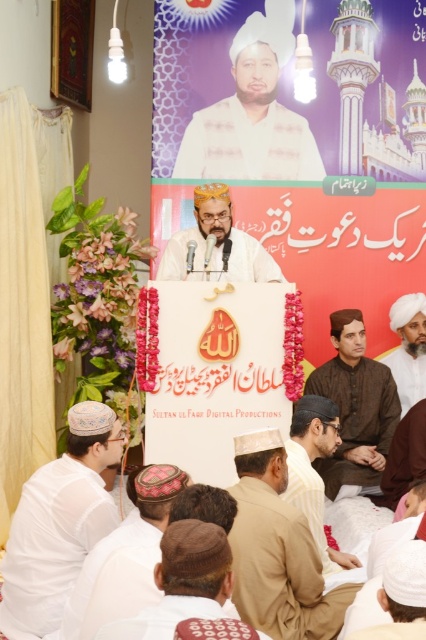
Question: Is white cotton cap at lower left wider than brown textured hat at lower center?

Choices:
 (A) yes
 (B) no

Answer: (A)

Question: Does matte gold crown at center appear over white matte turban at center?

Choices:
 (A) no
 (B) yes

Answer: (B)

Question: Which of the following is the farthest from the observer?

Choices:
 (A) light brown fabric at lower center
 (B) matte gold crown at center
 (C) brown cotton shirt at center
 (D) light brown fabric cap at center

Answer: (C)

Question: Which point appears closest to the camera in this image?

Choices:
 (A) (342, 557)
 (B) (339, 486)
 (C) (78, 497)
 (D) (213, 275)

Answer: (C)

Question: Based on their relative distances, which object is farther from the matte gold crown at center?

Choices:
 (A) white matte shirt at upper center
 (B) light brown fabric cap at center
 (C) white cotton turban at lower center
 (D) brown cotton shirt at center

Answer: (C)

Question: Can you confirm if brown cotton shirt at center is positioned above white cotton turban at lower center?

Choices:
 (A) no
 (B) yes

Answer: (B)